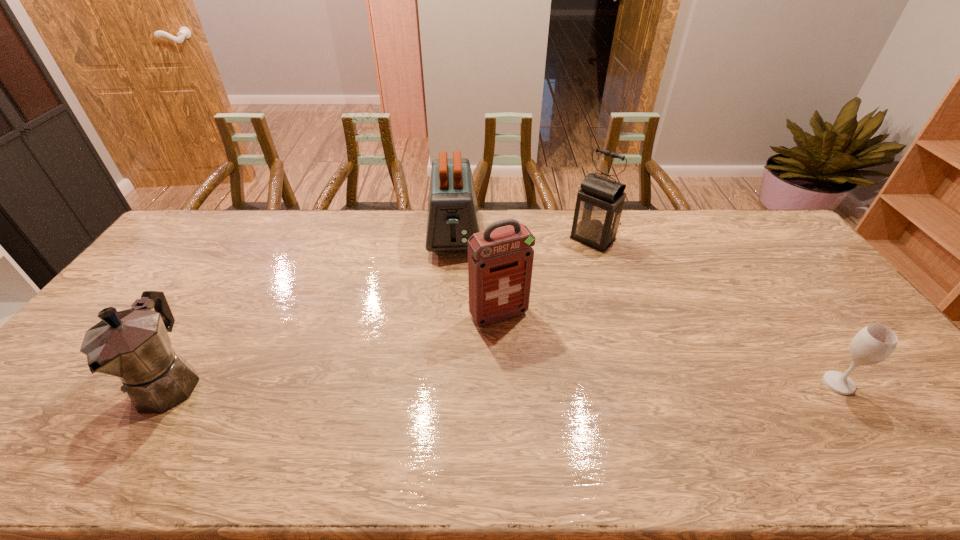
This screenshot has height=540, width=960. Identify the location of object positioned at the right edge. (874, 343).

Find the location of a particular element. object that is at the near right corner is located at coordinates (874, 343).

You are a GUI agent. You are given a task and a screenshot of the screen. Output one action in this format:
    pyautogui.click(x=<x>, y=<y>)
    Task: Click on the vacant space at the far edge of the desktop
    The height and width of the screenshot is (540, 960).
    Given the screenshot: What is the action you would take?
    pyautogui.click(x=665, y=212)

Identify the location of vacant space at the near edge of the desktop. [x=728, y=418].

In order to click on free space at the right edge of the desktop in this screenshot , I will do `click(847, 316)`.

You are a GUI agent. You are given a task and a screenshot of the screen. Output one action in this format:
    pyautogui.click(x=<x>, y=<y>)
    Task: Click on the free space at the near left corner
    Image resolution: width=960 pixels, height=540 pixels.
    Given the screenshot: What is the action you would take?
    pyautogui.click(x=99, y=393)

Identify the location of free space at the far right corner of the desktop. (729, 212).

The width and height of the screenshot is (960, 540). What are the coordinates of `free location at the near right corner of the desktop` in the screenshot? It's located at (887, 420).

In order to click on vacant region between the second object from right to left and the wineglass in this screenshot , I will do click(x=716, y=311).

Locate an element on the screen. The height and width of the screenshot is (540, 960). blank region between the shortest object and the leftmost object is located at coordinates (504, 383).